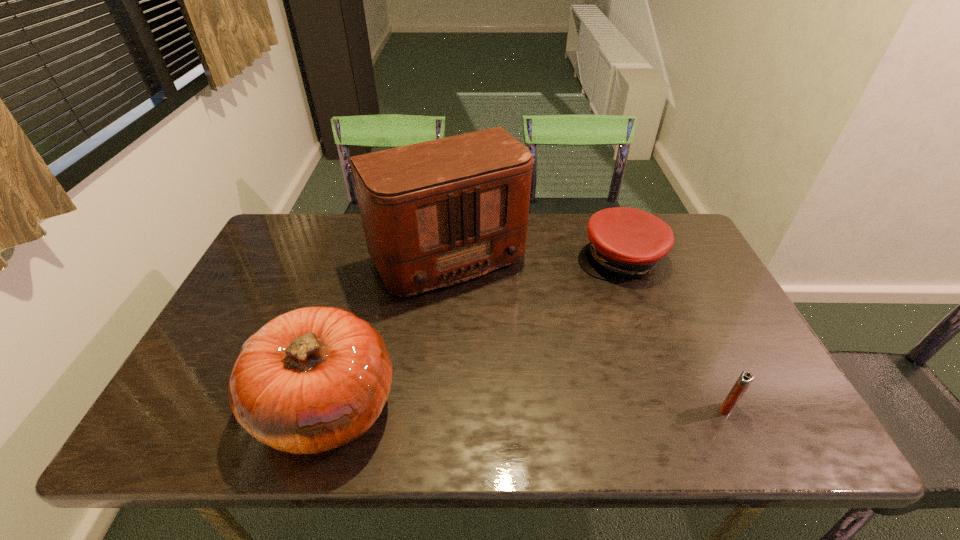
At what (x,y) coordinates should I click in order to perform the action: click on free location that satisfies the following two spatial constraints: 1. on the back side of the radio receiver; 2. on the left side of the pumpkin. Please return your answer as a coordinate pair (x, y). Looking at the image, I should click on tap(371, 257).